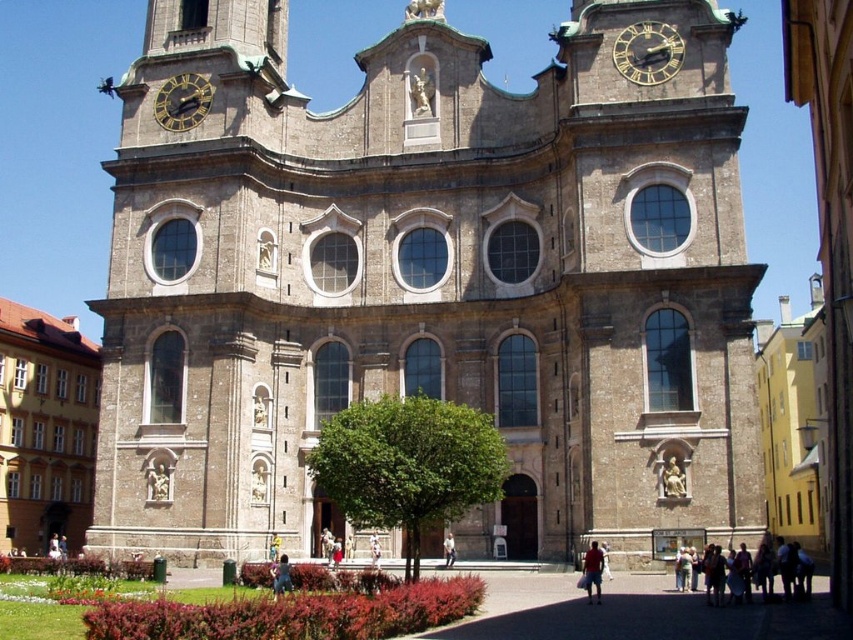
Question: Is brown stone tower at upper center to the right of light brown leather jacket at center from the viewer's perspective?

Choices:
 (A) yes
 (B) no

Answer: (B)

Question: Which is farther from the light brown leather bag at lower right?

Choices:
 (A) brown stone church at left
 (B) gold metallic clock at upper center
 (C) white cotton shirt at center

Answer: (A)

Question: Is brown stone tower at upper center closer to camera compared to goldmetallicclock at upper left?

Choices:
 (A) yes
 (B) no

Answer: (A)

Question: Which is farther from the light brown leather jacket at center?

Choices:
 (A) gold metallic clock at upper center
 (B) brown stone church at left

Answer: (B)

Question: Is brown stone tower at upper center above dark blue jeans at center?

Choices:
 (A) no
 (B) yes

Answer: (B)

Question: Among these objects, which one is farthest from the camera?

Choices:
 (A) dark blue jeans at center
 (B) light brown leather jacket at center
 (C) goldmetallicclock at upper left

Answer: (C)